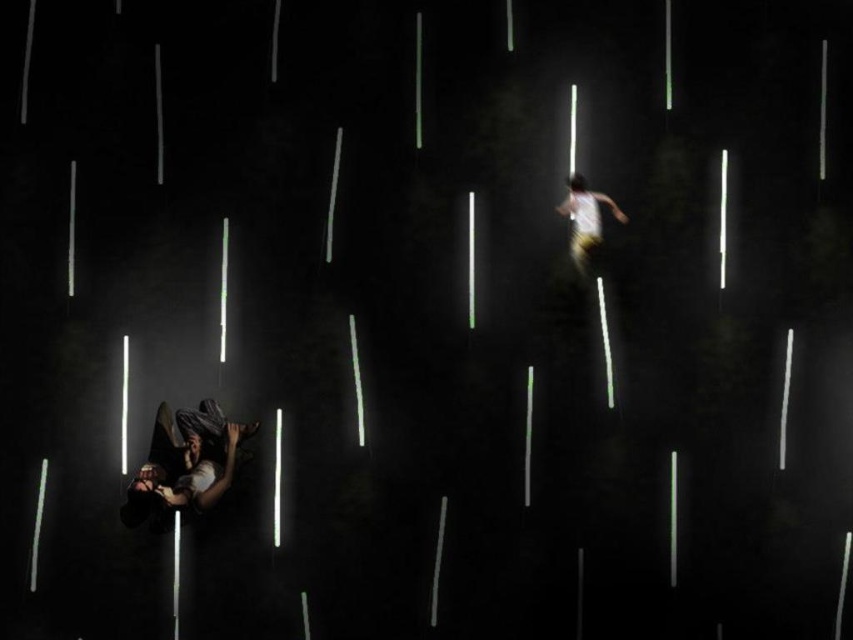
Question: Can you confirm if dark gray fabric at lower left is positioned to the left of white cotton shirt at upper right?

Choices:
 (A) no
 (B) yes

Answer: (B)

Question: Which point is farther to the camera?

Choices:
 (A) dark gray fabric at lower left
 (B) white cotton shirt at upper right

Answer: (B)

Question: Among these points, which one is farthest from the camera?

Choices:
 (A) (607, 202)
 (B) (149, 442)

Answer: (A)

Question: Which point is closer to the camera?

Choices:
 (A) dark gray fabric at lower left
 (B) white cotton shirt at upper right

Answer: (A)

Question: Does dark gray fabric at lower left appear on the left side of white cotton shirt at upper right?

Choices:
 (A) no
 (B) yes

Answer: (B)

Question: From the image, what is the correct spatial relationship of dark gray fabric at lower left in relation to white cotton shirt at upper right?

Choices:
 (A) right
 (B) left

Answer: (B)